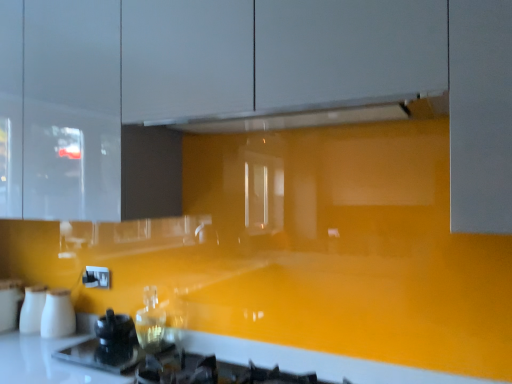
Question: Does black glossy kettle at lower left, which is the first appliance in right-to-left order, appear on the left side of white glossy exhaust hood at upper center?

Choices:
 (A) yes
 (B) no

Answer: (A)

Question: Is black glossy kettle at lower left, positioned as the fourth appliance in left-to-right order, turned away from white glossy exhaust hood at upper center?

Choices:
 (A) yes
 (B) no

Answer: (B)

Question: Is black glossy kettle at lower left, positioned as the fourth appliance in left-to-right order, thinner than white glossy exhaust hood at upper center?

Choices:
 (A) yes
 (B) no

Answer: (A)

Question: Is the position of black glossy kettle at lower left, positioned as the fourth appliance in left-to-right order, less distant than that of white glossy exhaust hood at upper center?

Choices:
 (A) no
 (B) yes

Answer: (A)

Question: Does black glossy kettle at lower left, which is the first appliance in right-to-left order, have a larger size compared to white glossy exhaust hood at upper center?

Choices:
 (A) no
 (B) yes

Answer: (A)

Question: Considering the relative positions of glossy yellow countertop at lower center and white glossy salt and pepper shakers at left, which appears as the 1th appliance when viewed from the left, in the image provided, is glossy yellow countertop at lower center to the left or to the right of white glossy salt and pepper shakers at left, which appears as the 1th appliance when viewed from the left,?

Choices:
 (A) right
 (B) left

Answer: (A)

Question: In terms of height, does glossy yellow countertop at lower center look taller or shorter compared to white glossy salt and pepper shakers at left, the 4th appliance viewed from the right?

Choices:
 (A) short
 (B) tall

Answer: (A)

Question: Considering the positions of point (4, 382) and point (22, 297), is point (4, 382) closer or farther from the camera than point (22, 297)?

Choices:
 (A) closer
 (B) farther

Answer: (A)

Question: In terms of width, does glossy yellow countertop at lower center look wider or thinner when compared to white glossy salt and pepper shakers at left, which appears as the 1th appliance when viewed from the left?

Choices:
 (A) thin
 (B) wide

Answer: (A)

Question: Is white matte milk jugs at lower left, placed as the second appliance when sorted from right to left, in front of or behind white glossy exhaust hood at upper center in the image?

Choices:
 (A) behind
 (B) front

Answer: (A)

Question: Based on their positions, is white matte milk jugs at lower left, placed as the second appliance when sorted from right to left, located to the left or right of white glossy exhaust hood at upper center?

Choices:
 (A) left
 (B) right

Answer: (A)

Question: Considering the positions of white matte milk jugs at lower left, placed as the second appliance when sorted from right to left, and white glossy exhaust hood at upper center in the image, is white matte milk jugs at lower left, placed as the second appliance when sorted from right to left, bigger or smaller than white glossy exhaust hood at upper center?

Choices:
 (A) small
 (B) big

Answer: (A)

Question: From the image's perspective, is white matte milk jugs at lower left, placed as the third appliance when sorted from left to right, located above or below white glossy exhaust hood at upper center?

Choices:
 (A) above
 (B) below

Answer: (B)

Question: Is white glossy salt and pepper shakers at lower left, the third appliance viewed from the right, inside the boundaries of glossy yellow countertop at lower center, or outside?

Choices:
 (A) outside
 (B) inside

Answer: (A)

Question: From their relative heights in the image, would you say white glossy salt and pepper shakers at lower left, the third appliance viewed from the right, is taller or shorter than glossy yellow countertop at lower center?

Choices:
 (A) short
 (B) tall

Answer: (B)